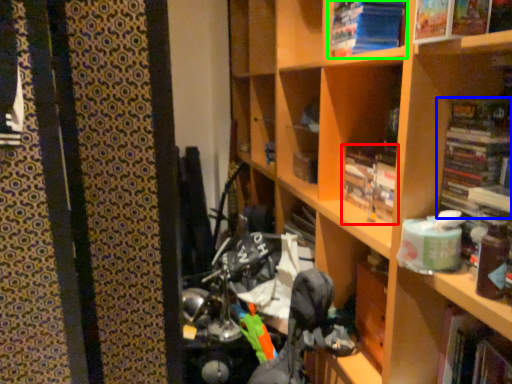
Question: Based on their relative distances, which object is farther from book (highlighted by a red box)? Choose from book (highlighted by a blue box) and book (highlighted by a green box).

Choices:
 (A) book
 (B) book

Answer: (B)